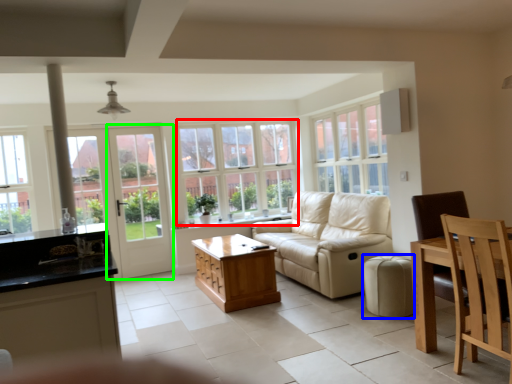
Question: Estimate the real-world distances between objects in this image. Which object is closer to window (highlighted by a red box), stool (highlighted by a blue box) or screen door (highlighted by a green box)?

Choices:
 (A) stool
 (B) screen door

Answer: (B)